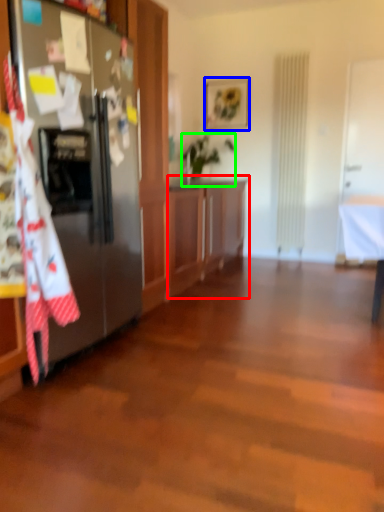
Question: Which object is positioned farthest from cabinetry (highlighted by a red box)? Select from picture frame (highlighted by a blue box) and houseplant (highlighted by a green box).

Choices:
 (A) picture frame
 (B) houseplant

Answer: (A)